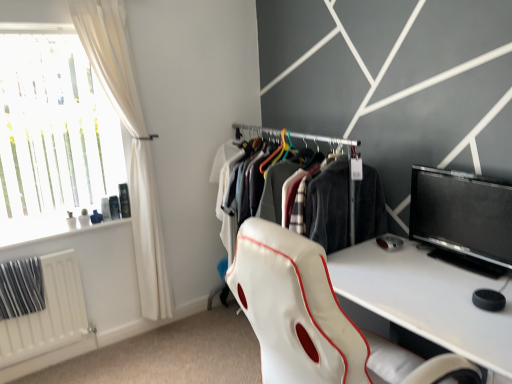
Question: Can you confirm if translucent glass window at upper left is wider than white matte radiator at lower left?

Choices:
 (A) no
 (B) yes

Answer: (B)

Question: Considering the relative positions of translucent glass window at upper left and white matte radiator at lower left in the image provided, is translucent glass window at upper left to the right of white matte radiator at lower left from the viewer's perspective?

Choices:
 (A) yes
 (B) no

Answer: (A)

Question: From a real-world perspective, does translucent glass window at upper left sit lower than white matte radiator at lower left?

Choices:
 (A) no
 (B) yes

Answer: (A)

Question: Does translucent glass window at upper left lie in front of white matte radiator at lower left?

Choices:
 (A) yes
 (B) no

Answer: (A)

Question: Is translucent glass window at upper left positioned behind white matte radiator at lower left?

Choices:
 (A) yes
 (B) no

Answer: (B)

Question: From a real-world perspective, relative to white leather chair at center, is white matte radiator at lower left vertically above or below?

Choices:
 (A) above
 (B) below

Answer: (B)

Question: Considering the positions of white matte radiator at lower left and white leather chair at center in the image, is white matte radiator at lower left bigger or smaller than white leather chair at center?

Choices:
 (A) small
 (B) big

Answer: (A)

Question: From the image's perspective, is white matte radiator at lower left located above or below white leather chair at center?

Choices:
 (A) below
 (B) above

Answer: (A)

Question: From their relative heights in the image, would you say white matte radiator at lower left is taller or shorter than white leather chair at center?

Choices:
 (A) short
 (B) tall

Answer: (A)

Question: From their relative heights in the image, would you say white fabric curtain at left is taller or shorter than white matte radiator at lower left?

Choices:
 (A) short
 (B) tall

Answer: (B)

Question: From a real-world perspective, relative to white matte radiator at lower left, is white fabric curtain at left vertically above or below?

Choices:
 (A) above
 (B) below

Answer: (A)

Question: Considering the positions of point (126, 84) and point (78, 329), is point (126, 84) closer or farther from the camera than point (78, 329)?

Choices:
 (A) closer
 (B) farther

Answer: (A)

Question: Would you say white fabric curtain at left is inside or outside white matte radiator at lower left?

Choices:
 (A) inside
 (B) outside

Answer: (B)

Question: Considering the positions of point (70, 334) and point (58, 225), is point (70, 334) closer or farther from the camera than point (58, 225)?

Choices:
 (A) farther
 (B) closer

Answer: (B)

Question: Would you say white matte radiator at lower left is inside or outside translucent glass window at upper left?

Choices:
 (A) outside
 (B) inside

Answer: (A)